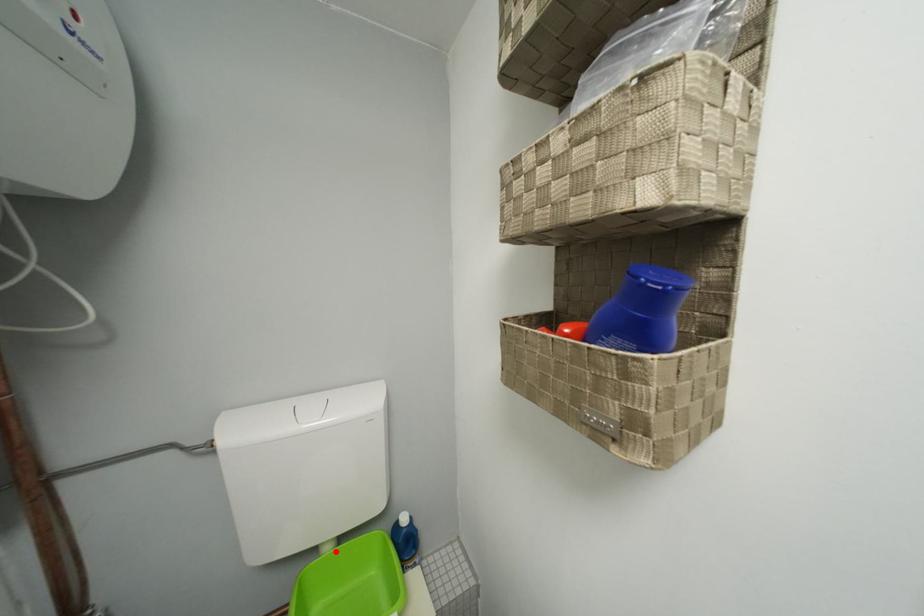
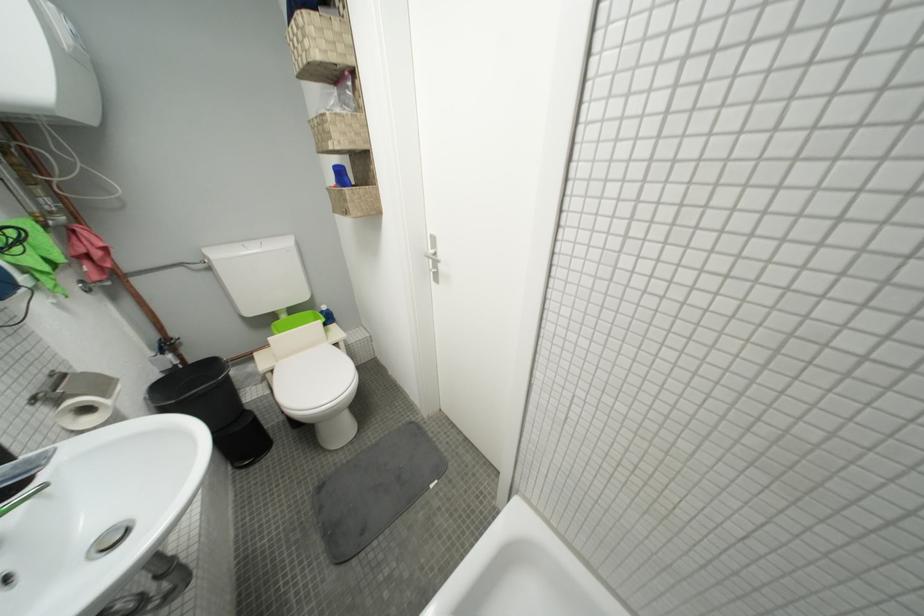
Question: I am providing you with two images of the same scene from different viewpoints. A red point is marked on the first image. Can you still see the location of the red point in image 2?

Choices:
 (A) Yes
 (B) No

Answer: (A)